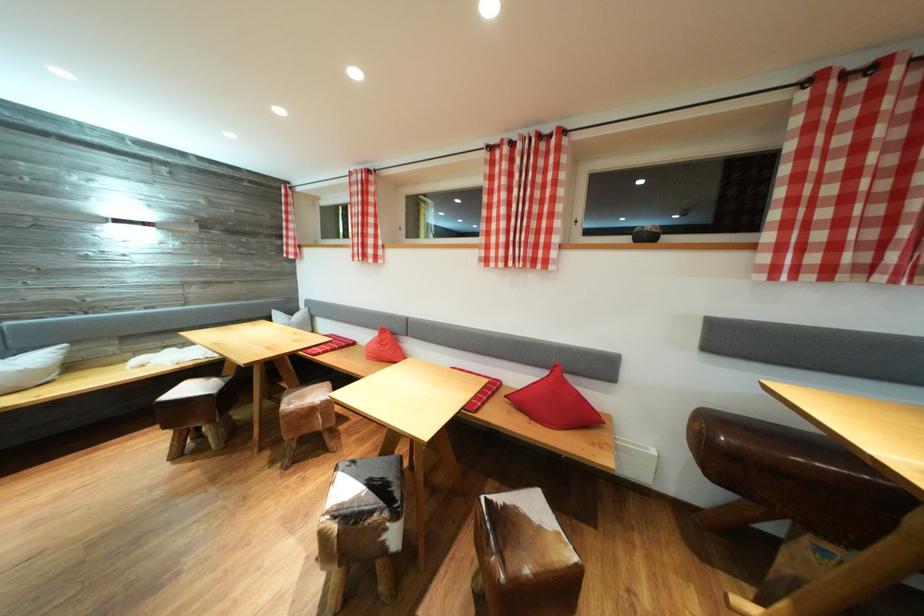
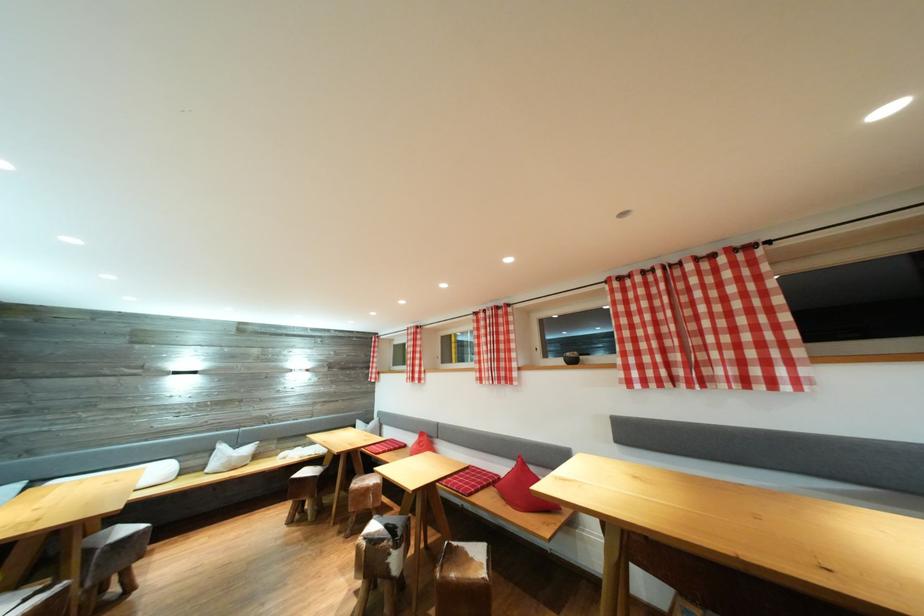
Where in the second image is the point corresponding to (371,209) from the first image?

(421, 351)